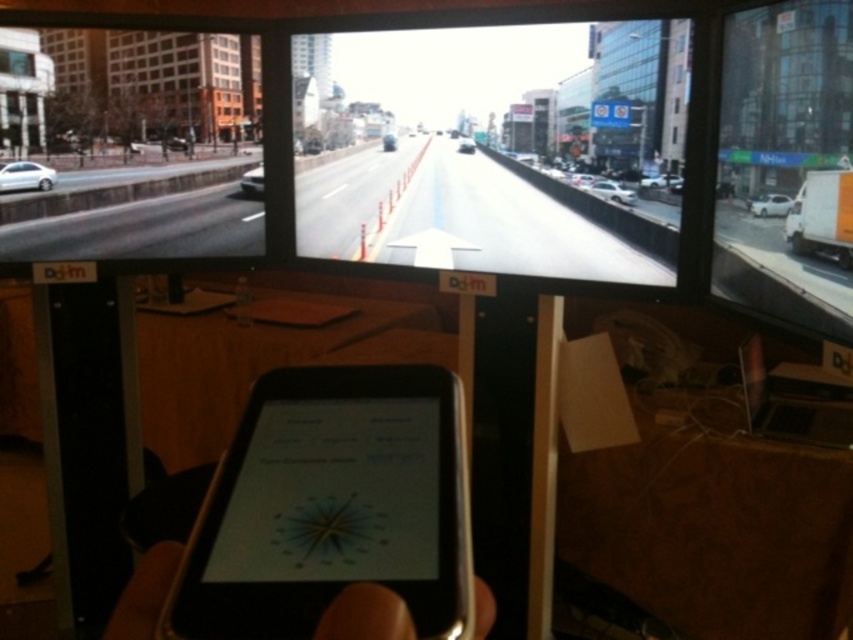
You are a delivery driver trying to navigate through the city using the map on your black glossy tablet at center and the traffic updates on the matte black monitor at left. Which device should you use to check the real time traffic conditions?

The matte black monitor at left is larger than the black glossy tablet at center, so it is better to use the matte black monitor at left to check real time traffic conditions because it provides a clearer and more detailed view.

You are a delivery driver who needs to park your shiny black car at center in a parking spot that is 1.8 meters wide. Will your car fit into the spot?

The shiny black car at center is 1.75 meters away from the camera, but the distance from the car to the parking spot isn not mentioned. Therefore, it is unclear if the car will fit into the 1.8 meter wide spot based on the given information.

You are a traffic officer observing the live traffic footage on the screens. You notice two cars, a shiny black car at center and a metallic silver car at center. Which car appears taller in the footage?

The shiny black car at center appears much taller than the metallic silver car at center in the footage.